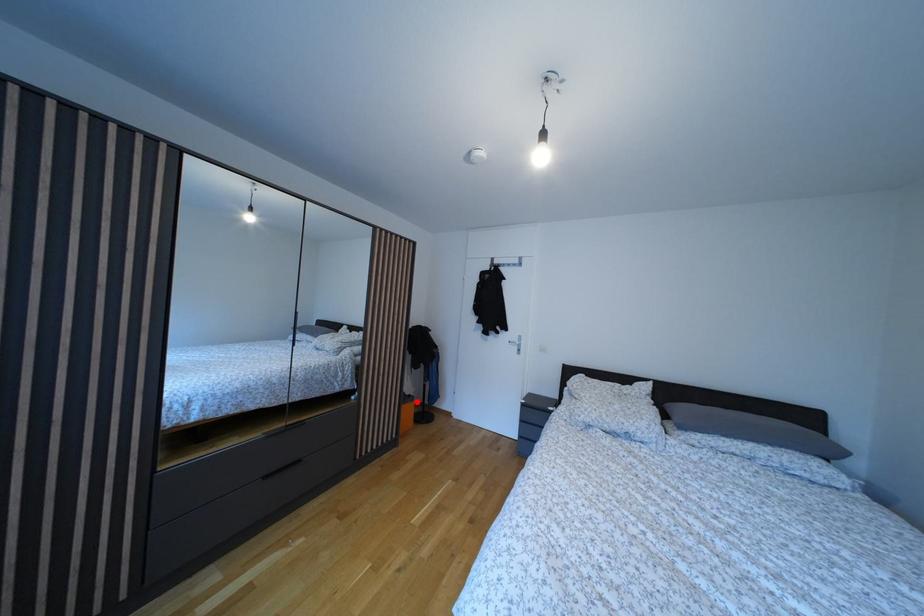
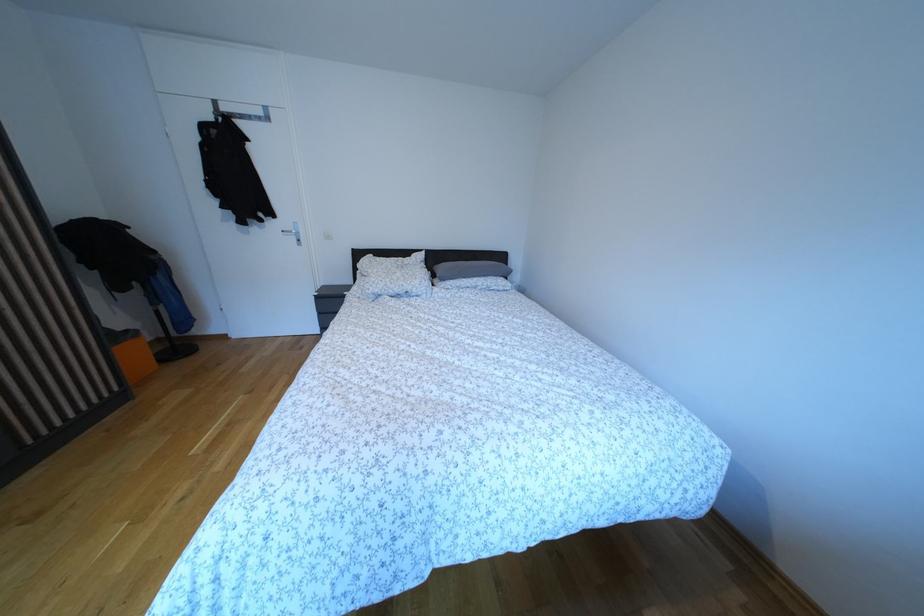
Question: I am providing you with two images of the same scene from different viewpoints. Given a red point in image1, look at the same physical point in image2. Is it:

Choices:
 (A) Closer to the viewpoint
 (B) Farther from the viewpoint

Answer: (A)